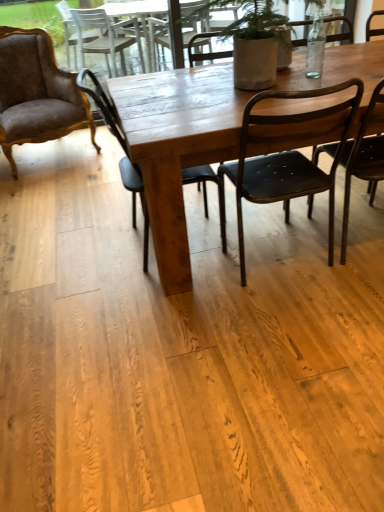
Question: Considering the relative sizes of wooden table at center and black metal chair at center, the third chair in the left-to-right sequence, in the image provided, is wooden table at center smaller than black metal chair at center, the third chair in the left-to-right sequence,?

Choices:
 (A) no
 (B) yes

Answer: (A)

Question: From the image's perspective, would you say wooden table at center is positioned over black metal chair at center, which is the second chair in right-to-left order?

Choices:
 (A) no
 (B) yes

Answer: (B)

Question: Is wooden table at center facing away from black metal chair at center, which is the second chair in right-to-left order?

Choices:
 (A) yes
 (B) no

Answer: (B)

Question: From a real-world perspective, does wooden table at center sit lower than black metal chair at center, the third chair in the left-to-right sequence?

Choices:
 (A) no
 (B) yes

Answer: (B)

Question: Is wooden table at center bigger than black metal chair at center, which is the second chair in right-to-left order?

Choices:
 (A) yes
 (B) no

Answer: (A)

Question: Does wooden table at center have a greater width compared to black metal chair at center, which is the second chair in right-to-left order?

Choices:
 (A) no
 (B) yes

Answer: (B)

Question: From the image's perspective, is black metal chair at right, arranged as the fourth chair when viewed from the left, on top of velvet brown armchair at left, arranged as the 4th chair when viewed from the right?

Choices:
 (A) no
 (B) yes

Answer: (A)

Question: Does black metal chair at right, arranged as the fourth chair when viewed from the left, have a greater width compared to velvet brown armchair at left, arranged as the 4th chair when viewed from the right?

Choices:
 (A) no
 (B) yes

Answer: (A)

Question: From a real-world perspective, is black metal chair at right, which is counted as the 1th chair, starting from the right, positioned under velvet brown armchair at left, arranged as the 4th chair when viewed from the right, based on gravity?

Choices:
 (A) no
 (B) yes

Answer: (A)

Question: From a real-world perspective, is black metal chair at right, arranged as the fourth chair when viewed from the left, located higher than velvet brown armchair at left, arranged as the 4th chair when viewed from the right?

Choices:
 (A) yes
 (B) no

Answer: (A)

Question: Is black metal chair at right, arranged as the fourth chair when viewed from the left, smaller than velvet brown armchair at left, placed as the 1th chair when sorted from left to right?

Choices:
 (A) no
 (B) yes

Answer: (B)

Question: Is black metal chair at right, which is counted as the 1th chair, starting from the right, outside velvet brown armchair at left, arranged as the 4th chair when viewed from the right?

Choices:
 (A) yes
 (B) no

Answer: (A)

Question: Does wooden table at center have a greater width compared to matte black chair at center, the 3th chair viewed from the right?

Choices:
 (A) no
 (B) yes

Answer: (B)